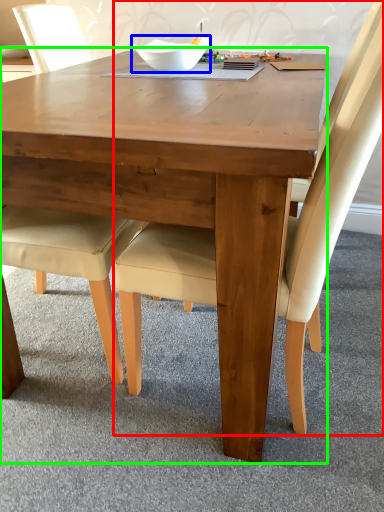
Question: Which object is the farthest from chair (highlighted by a red box)? Choose among these: bowl (highlighted by a blue box) or coffee table (highlighted by a green box).

Choices:
 (A) bowl
 (B) coffee table

Answer: (A)